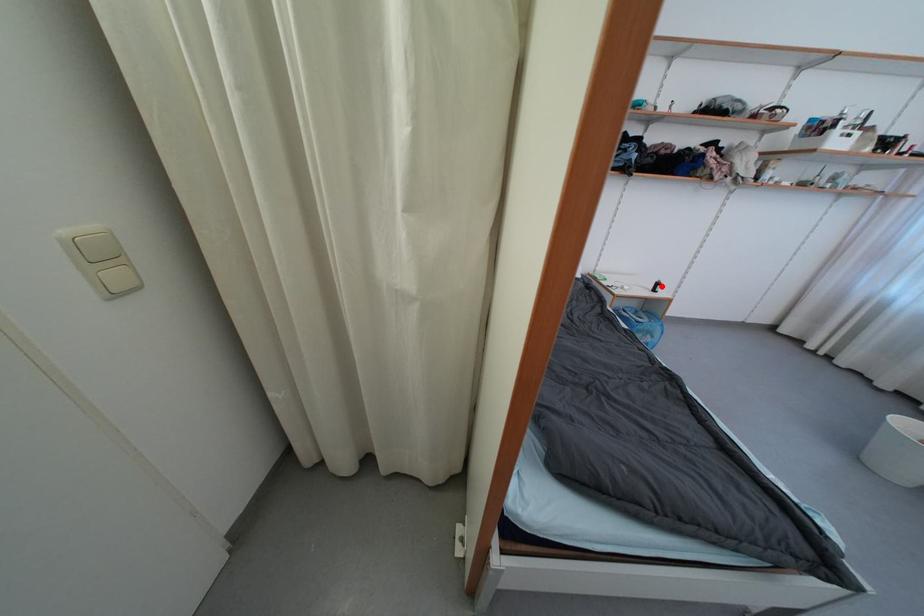
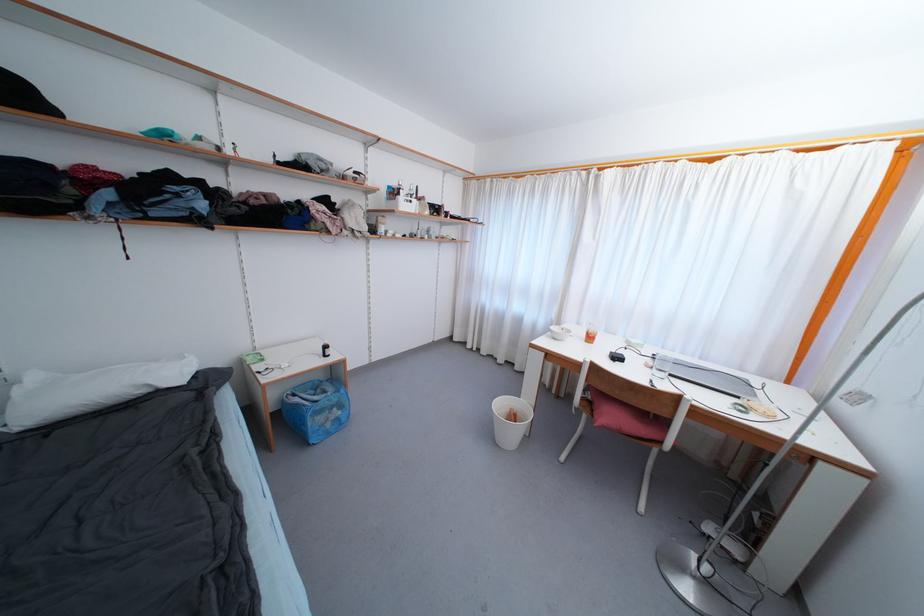
Question: A red point is marked in image1. In image2, is the corresponding 3D point closer to the camera or farther? Reply with the corresponding letter.

Choices:
 (A) The corresponding 3D point is closer.
 (B) The corresponding 3D point is farther.

Answer: (A)